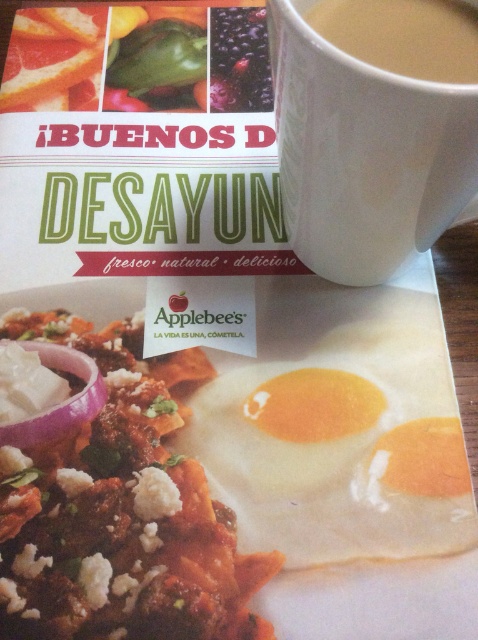
Does white ceramic mug at upper center appear over purple translucent onion at lower left?

Correct, white ceramic mug at upper center is located above purple translucent onion at lower left.

Does point (467, 173) lie behind point (94, 417)?

No.

The width and height of the screenshot is (478, 640). I want to click on white ceramic mug at upper center, so click(x=365, y=154).

Between white fried egg at center and white matte mug at upper center, which one has less height?

white matte mug at upper center is shorter.

Who is taller, white fried egg at center or white matte mug at upper center?

With more height is white fried egg at center.

Where is `white fried egg at center`? The width and height of the screenshot is (478, 640). white fried egg at center is located at coordinates pyautogui.click(x=316, y=481).

The image size is (478, 640). In order to click on white fried egg at center in this screenshot , I will do `click(316, 481)`.

Between white fried egg at center and purple translucent onion at lower left, which one appears on the right side from the viewer's perspective?

white fried egg at center

Which is below, white fried egg at center or purple translucent onion at lower left?

white fried egg at center is below.

This screenshot has width=478, height=640. In order to click on white fried egg at center in this screenshot , I will do click(x=316, y=481).